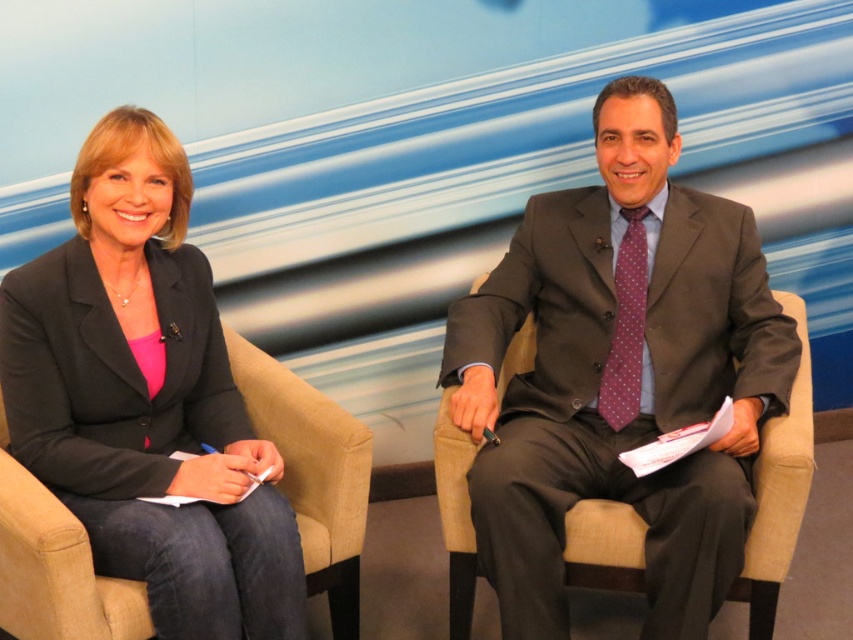
Question: Which point is closer to the camera?

Choices:
 (A) matte gray suit at right
 (B) matte black blazer at left
 (C) purple dotted fabric tie at right

Answer: (B)

Question: Does matte black blazer at left appear over purple dotted fabric tie at right?

Choices:
 (A) no
 (B) yes

Answer: (A)

Question: Estimate the real-world distances between objects in this image. Which object is closer to the purple dotted fabric tie at right?

Choices:
 (A) matte gray suit at right
 (B) matte black blazer at left

Answer: (A)

Question: Does matte gray suit at right have a larger size compared to matte black blazer at left?

Choices:
 (A) yes
 (B) no

Answer: (A)

Question: Is matte gray suit at right below purple dotted fabric tie at right?

Choices:
 (A) yes
 (B) no

Answer: (A)

Question: Which point is closer to the camera?

Choices:
 (A) (618, 470)
 (B) (22, 404)

Answer: (B)